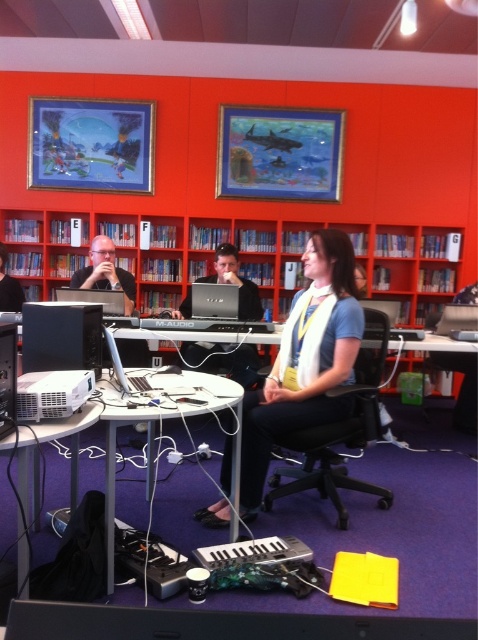
You are standing in the library and want to reach both the point at coordinates point (32, 298) and point (311, 262). Which point should you approach first to get closer to the viewer?

You should approach point (32, 298) first because it is closer to the viewer compared to point (311, 262).

You are standing at the entrance of the library and see the black plastic monitor at lower center. If you walk straight towards it, will you reach it before the bookshelves labeled with letters?

The black plastic monitor at lower center is located at point (216, 625), so walking straight towards it from the entrance would mean you reach it before encountering the bookshelves labeled with letters.